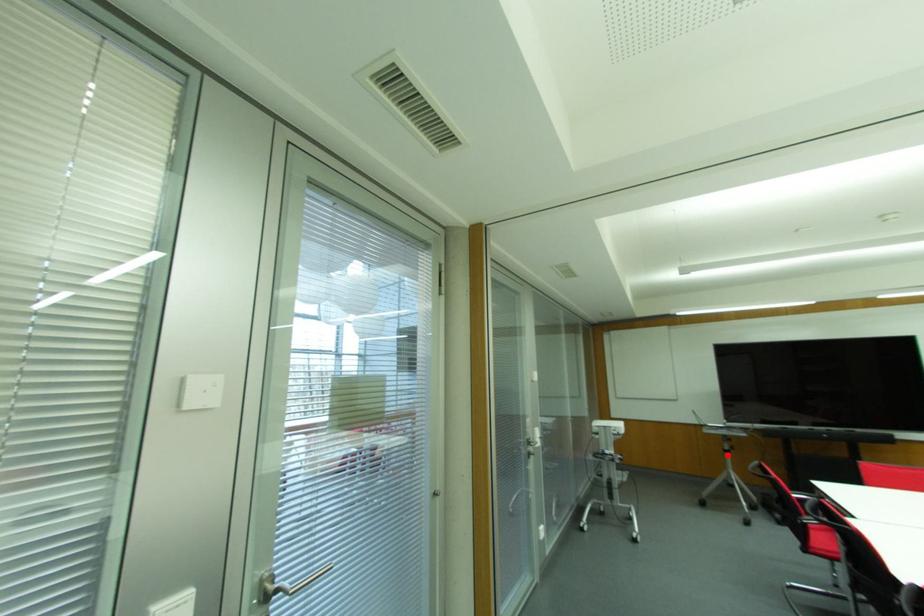
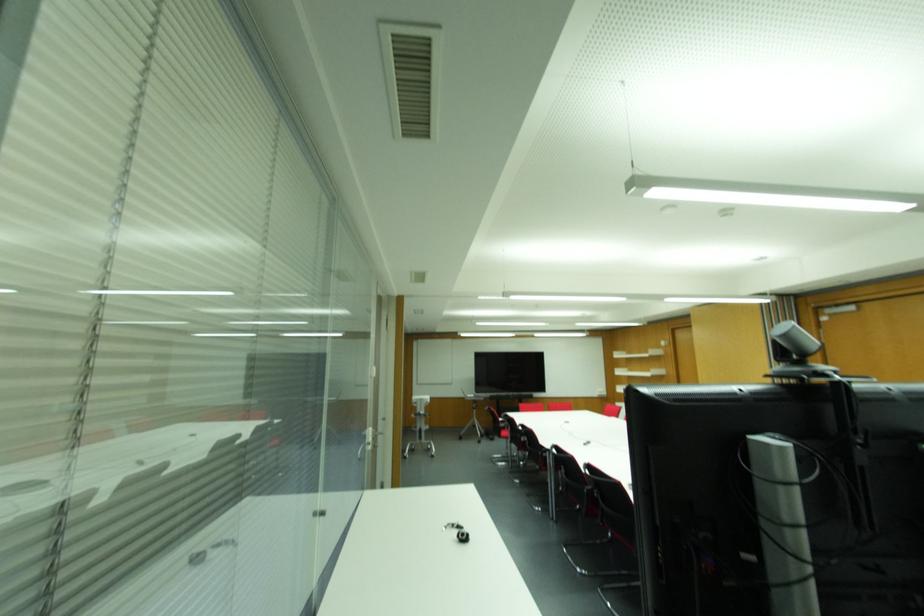
The point at the highlighted location is marked in the first image. Where is the corresponding point in the second image?

(473, 410)